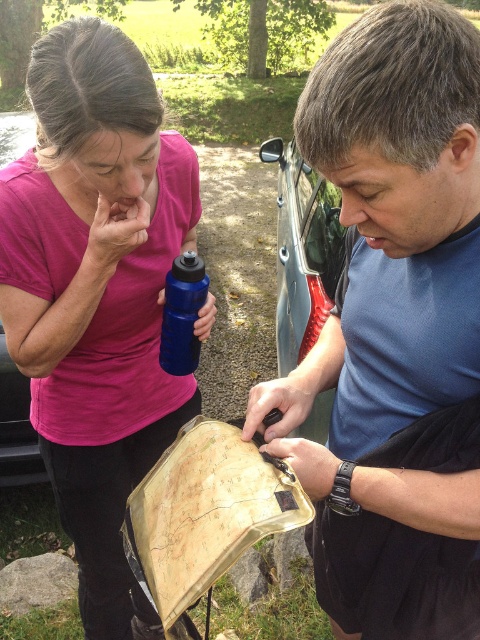
Is point (371, 177) positioned behind point (173, 336)?

No, it is in front of (173, 336).

Who is taller, matte plastic map at center or blue matte water bottle at center?

matte plastic map at center

I want to click on matte plastic map at center, so click(x=395, y=330).

Can you confirm if matte plastic map at center is bigger than metallic silver car at center?

Actually, matte plastic map at center might be smaller than metallic silver car at center.

Which is in front, point (447, 436) or point (299, 246)?

Positioned in front is point (447, 436).

Is point (402, 225) less distant than point (308, 275)?

Yes, it is.

Locate an element on the screen. The image size is (480, 640). matte plastic map at center is located at coordinates (395, 330).

Who is positioned more to the left, blue matte water bottle at center or metallic blue car at left?

From the viewer's perspective, metallic blue car at left appears more on the left side.

Who is lower down, blue matte water bottle at center or metallic blue car at left?

metallic blue car at left is lower down.

Between point (206, 285) and point (25, 436), which one is positioned behind?

Positioned behind is point (25, 436).

The image size is (480, 640). Find the location of `blue matte water bottle at center`. blue matte water bottle at center is located at coordinates (181, 314).